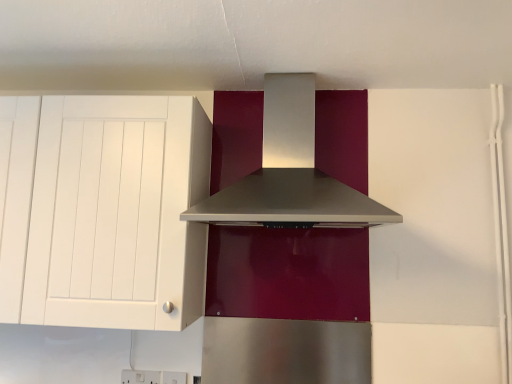
Question: From a real-world perspective, is white matte cabinet at left located higher than satin silver range hood at center?

Choices:
 (A) no
 (B) yes

Answer: (A)

Question: Are white matte cabinet at left and satin silver range hood at center located far from each other?

Choices:
 (A) yes
 (B) no

Answer: (B)

Question: Does white matte cabinet at left appear on the left side of satin silver range hood at center?

Choices:
 (A) no
 (B) yes

Answer: (B)

Question: From the image's perspective, is white matte cabinet at left under satin silver range hood at center?

Choices:
 (A) yes
 (B) no

Answer: (A)

Question: Is the position of white matte cabinet at left more distant than that of satin silver range hood at center?

Choices:
 (A) yes
 (B) no

Answer: (A)

Question: From the image's perspective, does white matte cabinet at left appear higher than satin silver range hood at center?

Choices:
 (A) no
 (B) yes

Answer: (A)

Question: Is satin silver range hood at center to the left of white matte cabinet at left from the viewer's perspective?

Choices:
 (A) yes
 (B) no

Answer: (B)

Question: Considering the relative sizes of satin silver range hood at center and white matte cabinet at left in the image provided, is satin silver range hood at center bigger than white matte cabinet at left?

Choices:
 (A) yes
 (B) no

Answer: (B)

Question: Does satin silver range hood at center lie behind white matte cabinet at left?

Choices:
 (A) no
 (B) yes

Answer: (A)

Question: Is white matte cabinet at left at the back of satin silver range hood at center?

Choices:
 (A) no
 (B) yes

Answer: (A)

Question: From a real-world perspective, does satin silver range hood at center sit lower than white matte cabinet at left?

Choices:
 (A) yes
 (B) no

Answer: (B)

Question: Would you say satin silver range hood at center is outside white matte cabinet at left?

Choices:
 (A) no
 (B) yes

Answer: (B)

Question: From the image's perspective, is white matte cabinet at left above or below satin silver range hood at center?

Choices:
 (A) above
 (B) below

Answer: (B)